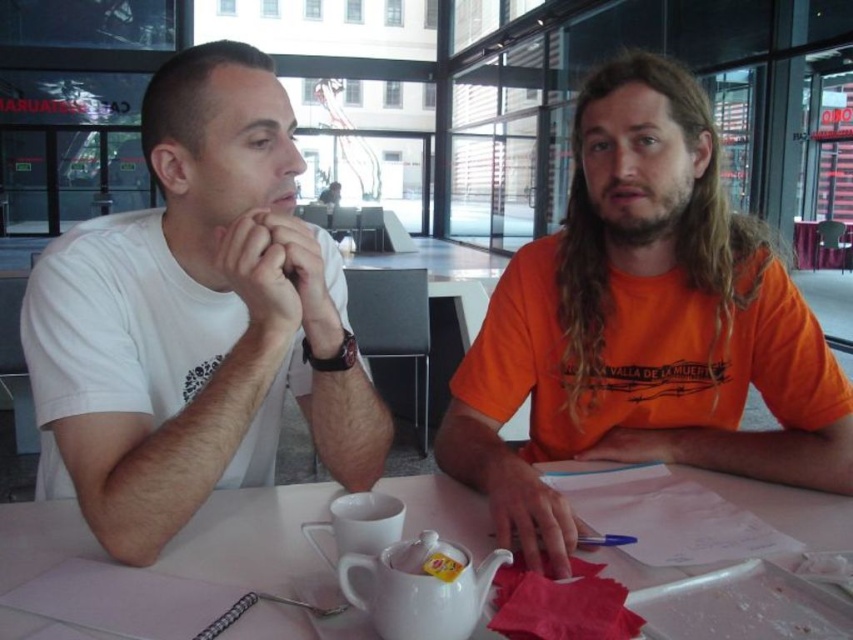
Who is positioned more to the right, white glossy table at center or white glossy tea pot at center?

white glossy table at center is more to the right.

Find the location of `white glossy table at center`. white glossy table at center is located at coordinates (251, 538).

Between point (460, 392) and point (350, 572), which one is positioned behind?

Positioned behind is point (460, 392).

In the scene shown: Is orange cotton shirt at center smaller than white glossy tea pot at center?

Actually, orange cotton shirt at center might be larger than white glossy tea pot at center.

Is point (444, 467) positioned in front of point (355, 595)?

No, (444, 467) is further to viewer.

You are a GUI agent. You are given a task and a screenshot of the screen. Output one action in this format:
    pyautogui.click(x=<x>, y=<y>)
    Task: Click on the orange cotton shirt at center
    The height and width of the screenshot is (640, 853).
    Given the screenshot: What is the action you would take?
    pyautogui.click(x=642, y=324)

Does white cotton t-shirt at left come in front of orange cotton shirt at center?

No.

Is white cotton t-shirt at left below orange cotton shirt at center?

No.

At what (x,y) coordinates should I click in order to perform the action: click on white cotton t-shirt at left. Please return your answer as a coordinate pair (x, y). Looking at the image, I should click on (195, 320).